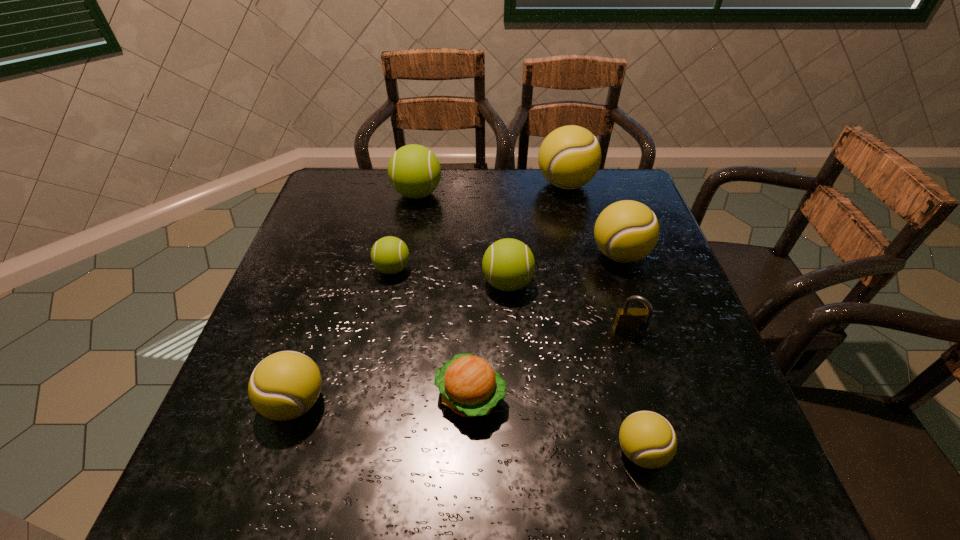
Where is `free space at the near left corner of the desktop`? The height and width of the screenshot is (540, 960). free space at the near left corner of the desktop is located at coordinates (243, 475).

This screenshot has width=960, height=540. In order to click on vacant area at the far right corner in this screenshot , I will do `click(609, 195)`.

In the image, there is a desktop. Identify the location of vacant space at the near right corner. (738, 474).

Identify the location of vacant point located between the padlock and the hamburger. (551, 366).

This screenshot has width=960, height=540. I want to click on free space between the tallest object and the leftmost object, so click(430, 293).

In order to click on vacant point located between the farthest green tennis ball and the smallest yellow tennis ball in this screenshot , I will do `click(529, 322)`.

This screenshot has width=960, height=540. Identify the location of vacant point located between the tallest object and the hamburger. (517, 291).

Locate an element on the screen. The height and width of the screenshot is (540, 960). vacant area that lies between the farthest green tennis ball and the leftmost object is located at coordinates (356, 298).

Where is `vacant area between the hamburger and the fourth nearest object`? The height and width of the screenshot is (540, 960). vacant area between the hamburger and the fourth nearest object is located at coordinates tap(551, 366).

Where is `free space between the leftmost yellow tennis ball and the third nearest yellow tennis ball`? free space between the leftmost yellow tennis ball and the third nearest yellow tennis ball is located at coordinates (458, 329).